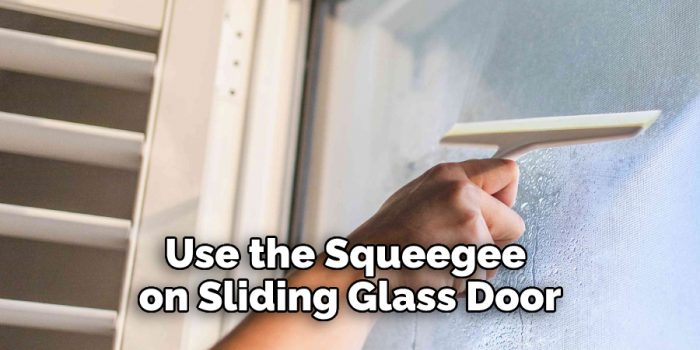
Image resolution: width=700 pixels, height=350 pixels. What are the coordinates of `door frame` in the screenshot? It's located at (297, 96).